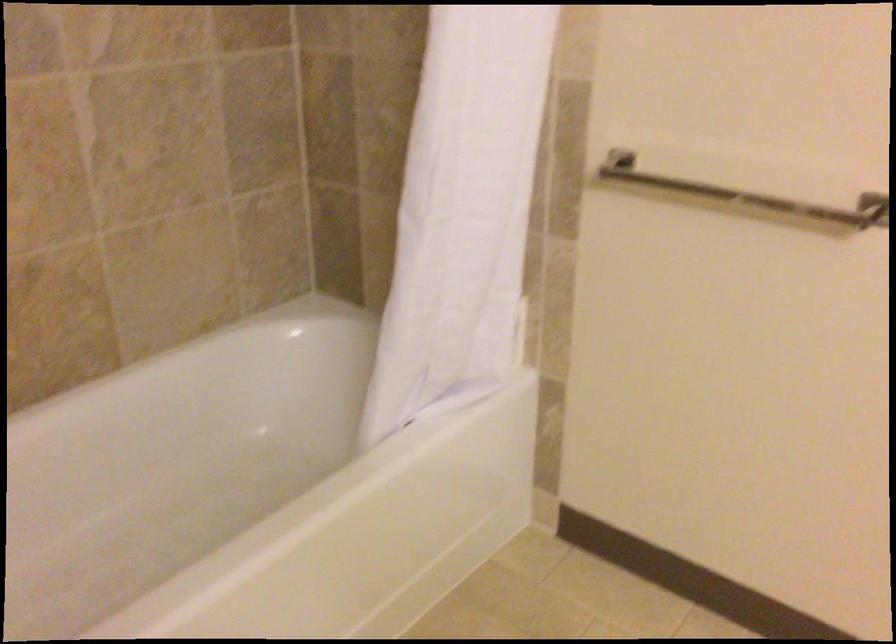
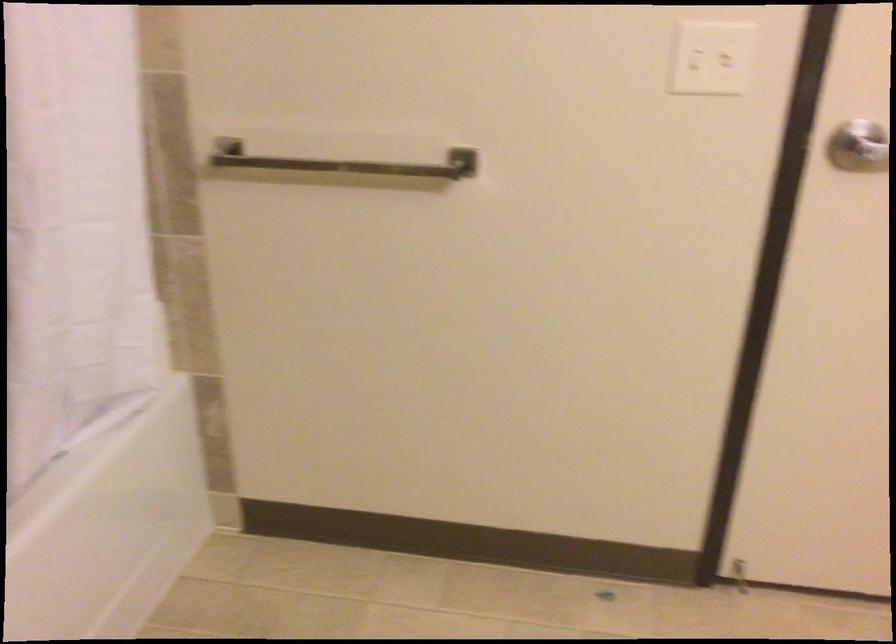
Question: The first image is from the beginning of the video and the second image is from the end. How did the camera likely rotate when shooting the video?

Choices:
 (A) Left
 (B) Right
 (C) Up
 (D) Down

Answer: (B)